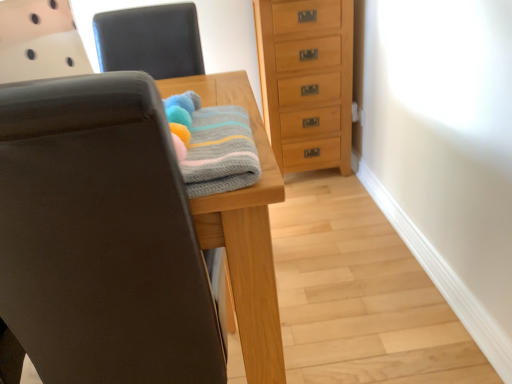
Question: Is matte black chair at left, placed as the first chair when sorted from bottom to top, in front of or behind knitted cotton towel at center in the image?

Choices:
 (A) front
 (B) behind

Answer: (A)

Question: Is matte black chair at left, arranged as the 2th chair when viewed from the top, situated inside knitted cotton towel at center or outside?

Choices:
 (A) outside
 (B) inside

Answer: (A)

Question: Estimate the real-world distances between objects in this image. Which object is farther from the leather-like black chair at upper center, which appears as the second chair when ordered from the bottom?

Choices:
 (A) matte black chair at left, placed as the first chair when sorted from bottom to top
 (B) light brown wood chest of drawers at center right
 (C) knitted cotton towel at center

Answer: (A)

Question: Estimate the real-world distances between objects in this image. Which object is farther from the leather-like black chair at upper center, which appears as the second chair when ordered from the bottom?

Choices:
 (A) light brown wood chest of drawers at center right
 (B) matte black chair at left, arranged as the 2th chair when viewed from the top
 (C) knitted cotton towel at center

Answer: (B)